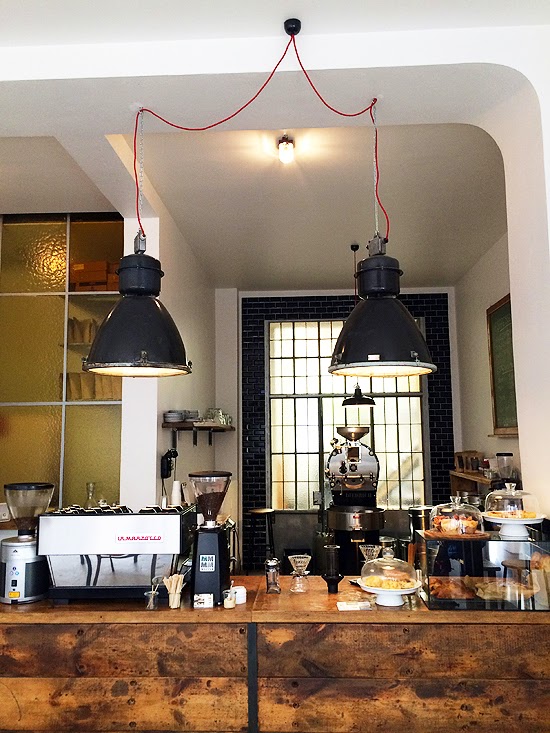
You are a GUI agent. You are given a task and a screenshot of the screen. Output one action in this format:
    pyautogui.click(x=<x>, y=<y>)
    Task: Click on the desk
    The width and height of the screenshot is (550, 733).
    Given the screenshot: What is the action you would take?
    pyautogui.click(x=348, y=627)